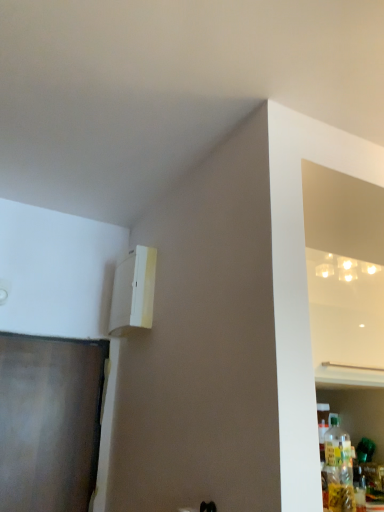
Identify the location of translucent plastic bottle at right. The image size is (384, 512). (339, 469).

What do you see at coordinates (339, 469) in the screenshot?
I see `translucent plastic bottle at right` at bounding box center [339, 469].

What is the approximate width of translucent plastic bottle at right?

translucent plastic bottle at right is 5.81 inches wide.

This screenshot has width=384, height=512. I want to click on translucent plastic bottle at right, so click(x=339, y=469).